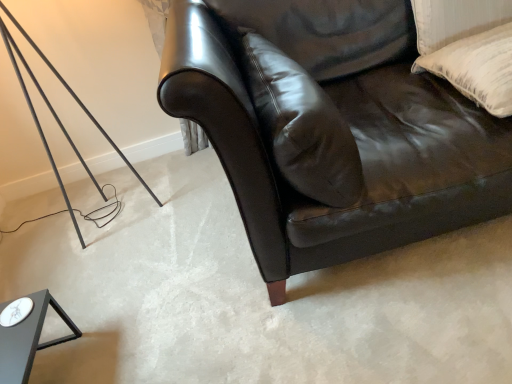
Question: In terms of width, does leather pillow at center, which is the second pillow from right to left, look wider or thinner when compared to shiny black leather couch at center?

Choices:
 (A) thin
 (B) wide

Answer: (A)

Question: Is leather pillow at center, which is the second pillow from right to left, inside or outside of shiny black leather couch at center?

Choices:
 (A) inside
 (B) outside

Answer: (A)

Question: Based on their relative distances, which object is nearer to the shiny black leather couch at center?

Choices:
 (A) leather pillow at center, which is the second pillow from right to left
 (B) white textured pillow at upper right, the first pillow positioned from the right

Answer: (A)

Question: Considering the real-world distances, which object is closest to the shiny black leather couch at center?

Choices:
 (A) white textured pillow at upper right, the first pillow positioned from the right
 (B) leather pillow at center, the first pillow when ordered from left to right

Answer: (B)